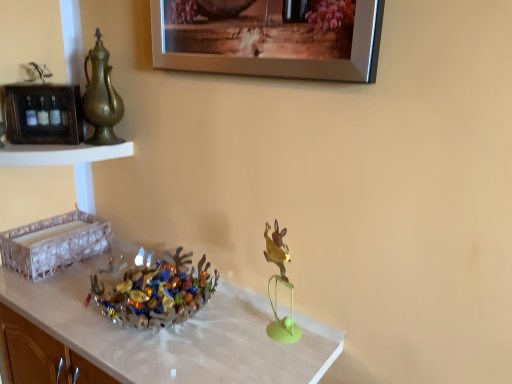
Where is `free space above translucent glass bowl at center (from a real-world perspective)`? Image resolution: width=512 pixels, height=384 pixels. free space above translucent glass bowl at center (from a real-world perspective) is located at coordinates (148, 328).